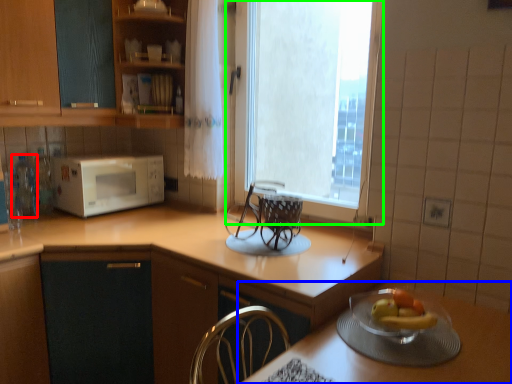
Question: Based on their relative distances, which object is nearer to bottle (highlighted by a red box)? Choose from table (highlighted by a blue box) and window (highlighted by a green box).

Choices:
 (A) table
 (B) window

Answer: (A)